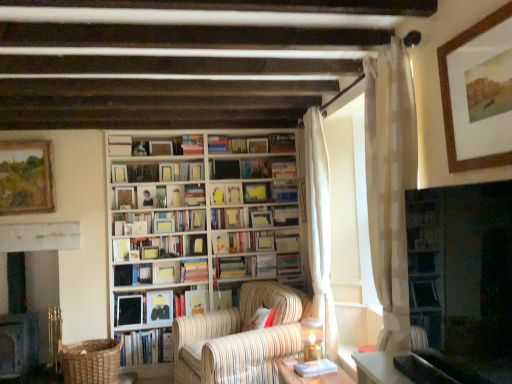
The image size is (512, 384). What do you see at coordinates (255, 241) in the screenshot? I see `hardcover books at center, which is counted as the 9th book, starting from the bottom` at bounding box center [255, 241].

Locate an element on the screen. This screenshot has width=512, height=384. hardcover book at center, the 12th book when ordered from bottom to top is located at coordinates (285, 215).

This screenshot has width=512, height=384. What do you see at coordinates (157, 172) in the screenshot?
I see `hardcover book at center, marked as the third book in a top-to-bottom arrangement` at bounding box center [157, 172].

This screenshot has width=512, height=384. What do you see at coordinates (253, 217) in the screenshot? I see `hardcover book at center, acting as the eleventh book starting from the bottom` at bounding box center [253, 217].

This screenshot has height=384, width=512. What do you see at coordinates (159, 306) in the screenshot? I see `matte black book at center, which is the fourth book from bottom to top` at bounding box center [159, 306].

Image resolution: width=512 pixels, height=384 pixels. What do you see at coordinates (450, 95) in the screenshot?
I see `wooden framed painting at upper right, the second picture frame positioned from the left` at bounding box center [450, 95].

Locate an element on the screen. Image resolution: width=512 pixels, height=384 pixels. hardcover books at center, which is counted as the 9th book, starting from the bottom is located at coordinates (255, 241).

In the image, is white sheer curtain at upper right, arranged as the first curtain when viewed from the front, positioned in front of or behind matte black book at center, which is the fourth book from bottom to top?

white sheer curtain at upper right, arranged as the first curtain when viewed from the front, is positioned closer to the viewer than matte black book at center, which is the fourth book from bottom to top.

In the scene shown: What's the angular difference between white sheer curtain at upper right, arranged as the first curtain when viewed from the front, and matte black book at center, which is the fourth book from bottom to top,'s facing directions?

The facing directions of white sheer curtain at upper right, arranged as the first curtain when viewed from the front, and matte black book at center, which is the fourth book from bottom to top, are 91.5 degrees apart.

From the white sheer curtain at upper right, arranged as the first curtain when viewed from the front, count 4th books backward and point to it. Please provide its 2D coordinates.

[(159, 306)]

Who is bigger, white sheer curtain at upper right, arranged as the first curtain when viewed from the front, or wooden framed painting at upper left, placed as the second picture frame when sorted from front to back?

white sheer curtain at upper right, arranged as the first curtain when viewed from the front, is bigger.

Considering the relative sizes of white sheer curtain at upper right, arranged as the first curtain when viewed from the front, and wooden framed painting at upper left, the second picture frame from the right, in the image provided, is white sheer curtain at upper right, arranged as the first curtain when viewed from the front, thinner than wooden framed painting at upper left, the second picture frame from the right,?

No.

Looking at this image, is white sheer curtain at upper right, which is counted as the 2th curtain, starting from the back, taller than wooden framed painting at upper left, positioned as the 1th picture frame in left-to-right order?

Indeed, white sheer curtain at upper right, which is counted as the 2th curtain, starting from the back, has a greater height compared to wooden framed painting at upper left, positioned as the 1th picture frame in left-to-right order.

Considering the positions of points (396, 224) and (31, 152), is point (396, 224) farther from camera compared to point (31, 152)?

No, it is not.

Looking at their sizes, would you say hardcover book at lower center, arranged as the second book when ordered from the bottom, is wider or thinner than white sheer curtain at right, which is the second curtain in front-to-back order?

In the image, hardcover book at lower center, arranged as the second book when ordered from the bottom, appears to be wider than white sheer curtain at right, which is the second curtain in front-to-back order.

Does hardcover book at lower center, which is the sixteenth book in top-to-bottom order, come in front of white sheer curtain at right, which is the second curtain in front-to-back order?

Yes, the depth of hardcover book at lower center, which is the sixteenth book in top-to-bottom order, is less than that of white sheer curtain at right, which is the second curtain in front-to-back order.

Considering the sizes of objects hardcover book at lower center, which is the sixteenth book in top-to-bottom order, and white sheer curtain at right, the 1th curtain viewed from the back, in the image provided, who is taller, hardcover book at lower center, which is the sixteenth book in top-to-bottom order, or white sheer curtain at right, the 1th curtain viewed from the back,?

With more height is white sheer curtain at right, the 1th curtain viewed from the back.

Which is more to the left, black glossy tv at right or matte black book at center, marked as the fourteenth book in a top-to-bottom arrangement?

Positioned to the left is matte black book at center, marked as the fourteenth book in a top-to-bottom arrangement.

From a real-world perspective, between black glossy tv at right and matte black book at center, marked as the fourteenth book in a top-to-bottom arrangement, who is vertically lower?

From a 3D spatial view, matte black book at center, marked as the fourteenth book in a top-to-bottom arrangement, is below.

Is black glossy tv at right not within matte black book at center, which is the fourth book from bottom to top?

black glossy tv at right is positioned outside matte black book at center, which is the fourth book from bottom to top.

Between matte yellow book at center, which is counted as the 8th book, starting from the bottom, and black glossy tv at right, which one has smaller width?

With smaller width is black glossy tv at right.

Consider the image. From the image's perspective, is matte yellow book at center, the 10th book when ordered from top to bottom, above or below black glossy tv at right?

matte yellow book at center, the 10th book when ordered from top to bottom, is situated lower than black glossy tv at right in the image.

How distant is matte yellow book at center, which is counted as the 8th book, starting from the bottom, from black glossy tv at right?

matte yellow book at center, which is counted as the 8th book, starting from the bottom, and black glossy tv at right are 9.45 feet apart from each other.

From a real-world perspective, is hardcover books at center, acting as the seventh book starting from the bottom, located beneath hardcover book at center, arranged as the 7th book when viewed from the top?

Yes.

Can you confirm if hardcover books at center, acting as the seventh book starting from the bottom, is taller than hardcover book at center, arranged as the 7th book when viewed from the top?

Yes.

There is a hardcover book at center, arranged as the 7th book when viewed from the top. At what (x,y) coordinates should I click in order to perform the action: click on the 4th book below it (from the image's perspective). Please return your answer as a coordinate pair (x, y). This screenshot has height=384, width=512. Looking at the image, I should click on (258, 266).

Which of these two, matte black book at center, placed as the 13th book when sorted from top to bottom, or matte black book at center, marked as the fourteenth book in a top-to-bottom arrangement, is wider?

Wider between the two is matte black book at center, placed as the 13th book when sorted from top to bottom.

Which of these two, matte black book at center, acting as the fifth book starting from the bottom, or matte black book at center, marked as the fourteenth book in a top-to-bottom arrangement, is smaller?

matte black book at center, marked as the fourteenth book in a top-to-bottom arrangement.

Is matte black book at center, acting as the fifth book starting from the bottom, situated inside matte black book at center, marked as the fourteenth book in a top-to-bottom arrangement, or outside?

matte black book at center, acting as the fifth book starting from the bottom, is not inside matte black book at center, marked as the fourteenth book in a top-to-bottom arrangement, it's outside.

Measure the distance between matte black book at center, acting as the fifth book starting from the bottom, and matte black book at center, which is the fourth book from bottom to top.

matte black book at center, acting as the fifth book starting from the bottom, is 3.37 inches from matte black book at center, which is the fourth book from bottom to top.

The width and height of the screenshot is (512, 384). Identify the location of the 9th book positioned below the white sheer curtain at upper right, arranged as the first curtain when viewed from the front (from the image's perspective). (159, 306).

Where is `picture frame that is the 1st object above the white sheer curtain at upper right, which is counted as the 2th curtain, starting from the back (from a real-world perspective)`? picture frame that is the 1st object above the white sheer curtain at upper right, which is counted as the 2th curtain, starting from the back (from a real-world perspective) is located at coordinates (26, 177).

Estimate the real-world distances between objects in this image. Which object is closer to wooden framed painting at upper left, positioned as the 1th picture frame in left-to-right order, white sheer curtain at upper right, which is counted as the 2th curtain, starting from the back, or dark gray stone fireplace at left?

Among the two, dark gray stone fireplace at left is located nearer to wooden framed painting at upper left, positioned as the 1th picture frame in left-to-right order.

When comparing their distances from matte black book at center, marked as the fourteenth book in a top-to-bottom arrangement, does white sheer curtain at upper right, arranged as the first curtain when viewed from the front, or matte black book at center, placed as the 13th book when sorted from top to bottom, seem further?

white sheer curtain at upper right, arranged as the first curtain when viewed from the front.

From the image, which object appears to be farther from hardcover book at lower center, which is the sixteenth book in top-to-bottom order, wooden bookcase at center or white sheer curtain at upper right, which is counted as the 2th curtain, starting from the back?

Based on the image, wooden bookcase at center appears to be further to hardcover book at lower center, which is the sixteenth book in top-to-bottom order.

Based on the photo, which object lies nearer to the anchor point hardcover book at center, positioned as the fifth book in top-to-bottom order, hardcover book at center, the fifteenth book in the top-to-bottom sequence, or hardcover book at center, the fourteenth book positioned from the bottom?

hardcover book at center, the fifteenth book in the top-to-bottom sequence, is positioned closer to the anchor hardcover book at center, positioned as the fifth book in top-to-bottom order.

Which object lies further to the anchor point hardcover book at center, which is the 15th book from bottom to top, hardcover book at lower center, which is the sixteenth book in top-to-bottom order, or wooden framed painting at upper left, placed as the second picture frame when sorted from front to back?

hardcover book at lower center, which is the sixteenth book in top-to-bottom order.

In the scene shown: Looking at the image, which one is located closer to striped fabric armchair at center, hardcover book at lower left, which ranks as the 1th book in bottom-to-top order, or hardcover book at center, positioned as the fifth book in top-to-bottom order?

hardcover book at lower left, which ranks as the 1th book in bottom-to-top order, is closer to striped fabric armchair at center.

Estimate the real-world distances between objects in this image. Which object is further from hardcover book at center, which ranks as the 4th book in top-to-bottom order, hardcover book at center, which is the sixth book in bottom-to-top order, or hardcover book at lower left, which ranks as the 1th book in bottom-to-top order?

hardcover book at lower left, which ranks as the 1th book in bottom-to-top order.

Considering their positions, is matte black book at center, placed as the 13th book when sorted from top to bottom, positioned closer to hardcover books at center, which is counted as the 9th book, starting from the bottom, than hardcover book at center, which is the sixth book in bottom-to-top order?

hardcover book at center, which is the sixth book in bottom-to-top order, is positioned closer to the anchor hardcover books at center, which is counted as the 9th book, starting from the bottom.

Locate an element on the screen. The image size is (512, 384). bookcase between wooden framed painting at upper right, the 2th picture frame positioned from the back, and hardcover books at center, arranged as the 11th book when viewed from the top, along the z-axis is located at coordinates (189, 221).

Where is `bookcase between wooden framed painting at upper right, the first picture frame viewed from the front, and hardcover book at center, positioned as the fifth book in top-to-bottom order, along the z-axis`? The width and height of the screenshot is (512, 384). bookcase between wooden framed painting at upper right, the first picture frame viewed from the front, and hardcover book at center, positioned as the fifth book in top-to-bottom order, along the z-axis is located at coordinates (189, 221).

The width and height of the screenshot is (512, 384). Find the location of `curtain between white sheer curtain at upper right, arranged as the first curtain when viewed from the front, and hardcover book at center, acting as the eleventh book starting from the bottom, in the front-back direction`. curtain between white sheer curtain at upper right, arranged as the first curtain when viewed from the front, and hardcover book at center, acting as the eleventh book starting from the bottom, in the front-back direction is located at coordinates (319, 228).

This screenshot has height=384, width=512. Identify the location of bookcase between wooden framed painting at upper left, the second picture frame from the right, and hardcover book at lower center, which is the sixteenth book in top-to-bottom order, from left to right. pyautogui.click(x=189, y=221).